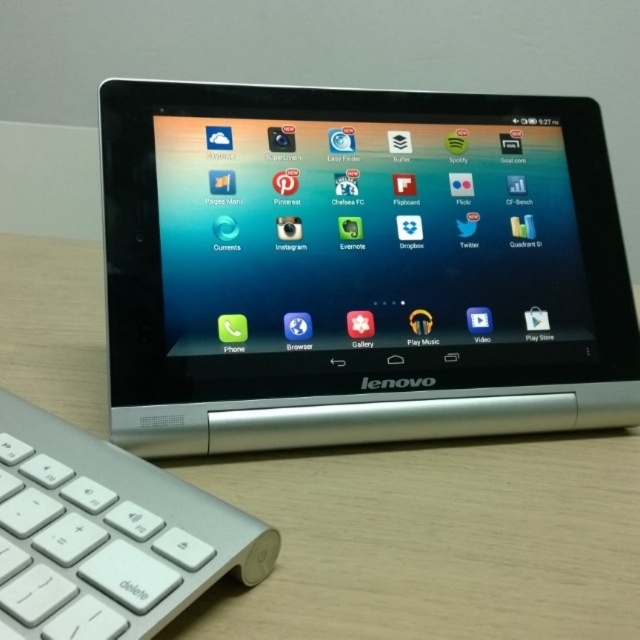
Question: Observing the image, what is the correct spatial positioning of wooden table at center in reference to white plastic keyboard at lower left?

Choices:
 (A) below
 (B) above

Answer: (B)

Question: Which object is closer to the camera taking this photo?

Choices:
 (A) wooden table at center
 (B) white plastic keyboard at lower left
 (C) silver metallic tablet at center

Answer: (B)

Question: Can you confirm if silver metallic tablet at center is positioned below wooden table at center?

Choices:
 (A) yes
 (B) no

Answer: (B)

Question: Can you confirm if silver metallic tablet at center is bigger than wooden table at center?

Choices:
 (A) no
 (B) yes

Answer: (A)

Question: Which of the following is the farthest from the observer?

Choices:
 (A) (13, 499)
 (B) (193, 268)
 (C) (600, 512)

Answer: (B)

Question: Which object is positioned closest to the wooden table at center?

Choices:
 (A) silver metallic tablet at center
 (B) white plastic keyboard at lower left

Answer: (A)